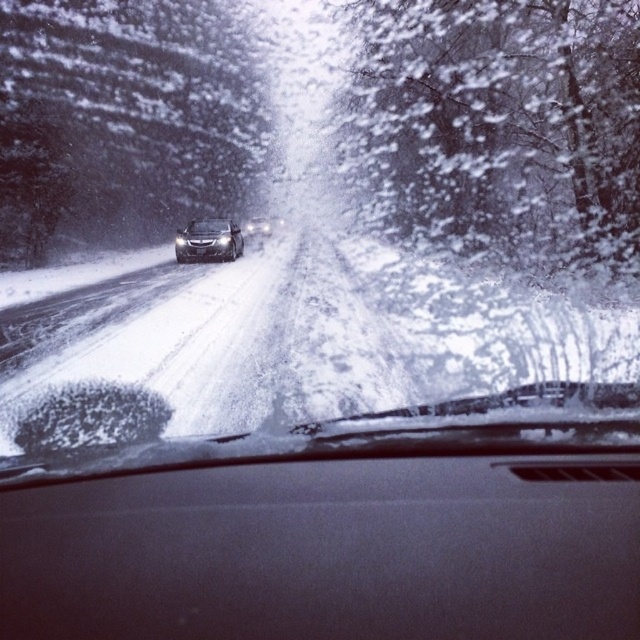
Question: Considering the relative positions of satin black dashboard at center and sleek silver sedan at center in the image provided, where is satin black dashboard at center located with respect to sleek silver sedan at center?

Choices:
 (A) below
 (B) above

Answer: (A)

Question: Is satin black dashboard at center thinner than sleek silver sedan at center?

Choices:
 (A) no
 (B) yes

Answer: (A)

Question: Which of the following is the farthest from the observer?

Choices:
 (A) transparent glass windshield at center
 (B) satin black dashboard at center
 (C) sleek silver sedan at center

Answer: (C)

Question: Which object is closer to the camera taking this photo?

Choices:
 (A) sleek silver sedan at center
 (B) satin black dashboard at center

Answer: (B)

Question: Is transparent glass windshield at center thinner than sleek silver sedan at center?

Choices:
 (A) yes
 (B) no

Answer: (B)

Question: Among these objects, which one is nearest to the camera?

Choices:
 (A) transparent glass windshield at center
 (B) sleek silver sedan at center
 (C) satin black dashboard at center

Answer: (C)